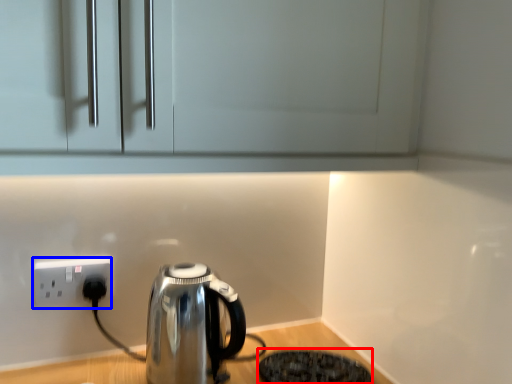
Question: Which point is closer to the camera, appliance (highlighted by a red box) or power plugs and sockets (highlighted by a blue box)?

Choices:
 (A) appliance
 (B) power plugs and sockets

Answer: (A)